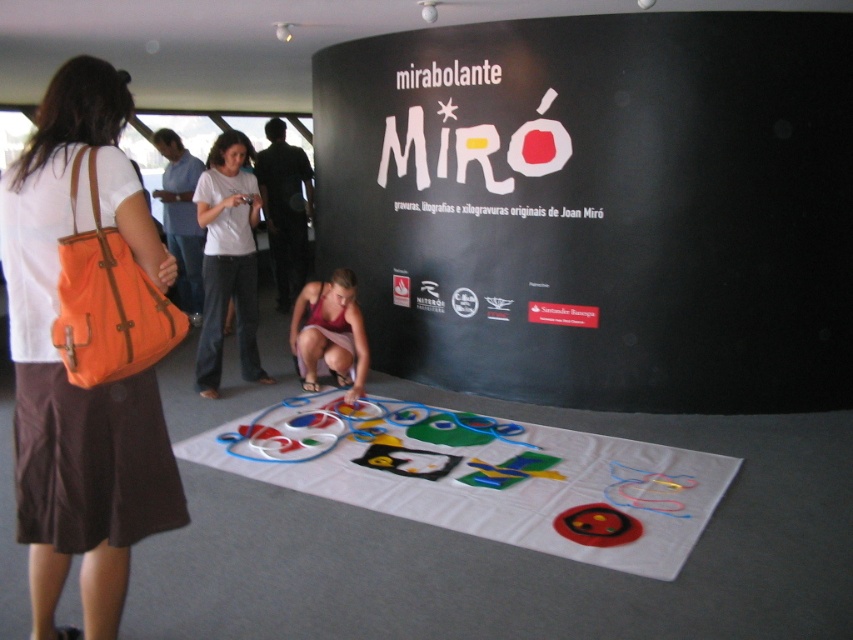
Based on the photo, between orange fabric bag at left and soft felt mat at center, which one appears on the right side from the viewer's perspective?

soft felt mat at center is more to the right.

The image size is (853, 640). Describe the element at coordinates (64, 369) in the screenshot. I see `orange fabric bag at left` at that location.

Find the location of a particular element. The width and height of the screenshot is (853, 640). orange fabric bag at left is located at coordinates (64, 369).

Does soft felt mat at center have a smaller size compared to pink fabric dress at center?

No.

Looking at this image, is soft felt mat at center thinner than pink fabric dress at center?

No, soft felt mat at center is not thinner than pink fabric dress at center.

Is point (524, 456) behind point (312, 289)?

No, it is not.

Where is `soft felt mat at center`? soft felt mat at center is located at coordinates (482, 476).

Which of these two, orange fabric bag at left or pink fabric dress at center, stands shorter?

pink fabric dress at center is shorter.

Which is in front, point (12, 218) or point (341, 289)?

Point (12, 218) is more forward.

Between point (115, 557) and point (323, 300), which one is positioned in front?

Point (115, 557) is in front.

Locate an element on the screen. The width and height of the screenshot is (853, 640). orange fabric bag at left is located at coordinates (64, 369).